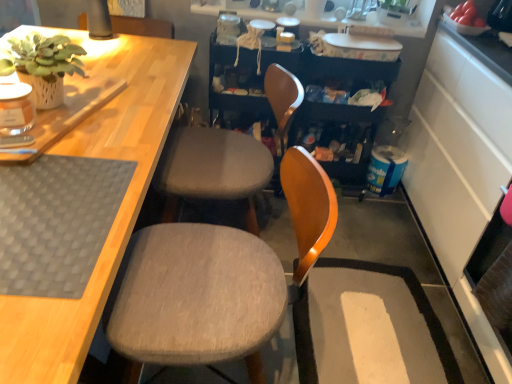
What do you see at coordinates (217, 280) in the screenshot? Image resolution: width=512 pixels, height=384 pixels. I see `gray fabric chair at center, the first chair in the front-to-back sequence` at bounding box center [217, 280].

The image size is (512, 384). What do you see at coordinates (212, 168) in the screenshot?
I see `textured gray cushion at center, the 2th chair positioned from the front` at bounding box center [212, 168].

Describe the element at coordinates (414, 21) in the screenshot. I see `white glossy shelves at upper center` at that location.

In order to face gray woven mat at lower left, should I rotate leftwards or rightwards?

It's best to rotate left around 26.937 degrees.

The width and height of the screenshot is (512, 384). I want to click on green matte plant at upper left, so click(x=42, y=65).

From the picture: From the image's perspective, which one is positioned lower, gray woven mat at lower left or white glossy shelves at upper center?

gray woven mat at lower left is shown below in the image.

Are gray woven mat at lower left and white glossy shelves at upper center beside each other?

gray woven mat at lower left and white glossy shelves at upper center are clearly separated.

Is point (15, 292) positioned in front of point (218, 12)?

Yes, it is in front of point (218, 12).

Consider the image. Between gray fabric chair at center, the first chair in the front-to-back sequence, and white textured rug at lower right, which one has larger size?

gray fabric chair at center, the first chair in the front-to-back sequence.

Between point (266, 322) and point (315, 356), which one is positioned behind?

The point (315, 356) is farther from the camera.

Is gray fabric chair at center, the first chair in the front-to-back sequence, oriented towards white textured rug at lower right?

No, gray fabric chair at center, the first chair in the front-to-back sequence, is not facing towards white textured rug at lower right.

In terms of width, does white glossy shelves at upper center look wider or thinner when compared to white textured rug at lower right?

Clearly, white glossy shelves at upper center has less width compared to white textured rug at lower right.

How much distance is there between white glossy shelves at upper center and white textured rug at lower right?

white glossy shelves at upper center and white textured rug at lower right are 4.51 feet apart from each other.

Does point (243, 13) appear closer or farther from the camera than point (413, 293)?

Point (243, 13) is farther from the camera than point (413, 293).

Are white glossy shelves at upper center and white textured rug at lower right beside each other?

They are not placed beside each other.

From the image's perspective, is gray woven mat at lower left on top of textured gray cushion at center, the first chair when ordered from back to front?

No, from the image's perspective, gray woven mat at lower left is not on top of textured gray cushion at center, the first chair when ordered from back to front.

Is point (4, 180) closer or farther from the camera than point (253, 173)?

Clearly, point (4, 180) is closer to the camera than point (253, 173).

Which of these two, gray woven mat at lower left or textured gray cushion at center, the first chair when ordered from back to front, is bigger?

→ textured gray cushion at center, the first chair when ordered from back to front.

Is gray woven mat at lower left positioned far away from textured gray cushion at center, the 2th chair positioned from the front?

No, gray woven mat at lower left is not far from textured gray cushion at center, the 2th chair positioned from the front.

Can you tell me how much white glossy shelves at upper center and gray fabric chair at center, which ranks as the 2th chair in back-to-front order, differ in facing direction?

The facing directions of white glossy shelves at upper center and gray fabric chair at center, which ranks as the 2th chair in back-to-front order, are 89.1 degrees apart.

From the image's perspective, is white glossy shelves at upper center beneath gray fabric chair at center, the first chair in the front-to-back sequence?

Actually, white glossy shelves at upper center appears above gray fabric chair at center, the first chair in the front-to-back sequence, in the image.

At what (x,y) coordinates should I click in order to perform the action: click on shelf that is behind the gray fabric chair at center, which ranks as the 2th chair in back-to-front order. Please return your answer as a coordinate pair (x, y). The width and height of the screenshot is (512, 384). Looking at the image, I should click on (414, 21).

Consider the image. Is white glossy shelves at upper center to the right of gray fabric chair at center, which ranks as the 2th chair in back-to-front order, from the viewer's perspective?

Correct, you'll find white glossy shelves at upper center to the right of gray fabric chair at center, which ranks as the 2th chair in back-to-front order.

Is white textured rug at lower right facing towards textured gray cushion at center, the 2th chair positioned from the front?

No, white textured rug at lower right is not turned towards textured gray cushion at center, the 2th chair positioned from the front.

Between white textured rug at lower right and textured gray cushion at center, the first chair when ordered from back to front, which one has more height?

Standing taller between the two is textured gray cushion at center, the first chair when ordered from back to front.

Which object is positioned more to the right, white textured rug at lower right or textured gray cushion at center, the first chair when ordered from back to front?

white textured rug at lower right.

Can you confirm if textured gray cushion at center, the first chair when ordered from back to front, is positioned to the right of white textured rug at lower right?

Incorrect, textured gray cushion at center, the first chair when ordered from back to front, is not on the right side of white textured rug at lower right.

In terms of size, does textured gray cushion at center, the 2th chair positioned from the front, appear bigger or smaller than white textured rug at lower right?

Considering their sizes, textured gray cushion at center, the 2th chair positioned from the front, takes up more space than white textured rug at lower right.

Who is taller, textured gray cushion at center, the 2th chair positioned from the front, or white textured rug at lower right?

Standing taller between the two is textured gray cushion at center, the 2th chair positioned from the front.

Is textured gray cushion at center, the first chair when ordered from back to front, touching white textured rug at lower right?

textured gray cushion at center, the first chair when ordered from back to front, and white textured rug at lower right are not in contact.

At what (x,y) coordinates should I click in order to perform the action: click on shelf above the gray woven mat at lower left (from a real-world perspective). Please return your answer as a coordinate pair (x, y). The width and height of the screenshot is (512, 384). Looking at the image, I should click on (414, 21).

Locate an element on the screen. wide below the gray fabric chair at center, the first chair in the front-to-back sequence (from a real-world perspective) is located at coordinates (369, 327).

Considering their positions, is white glossy shelves at upper center positioned closer to gray fabric chair at center, the first chair in the front-to-back sequence, than gray woven mat at lower left?

gray woven mat at lower left.

Looking at this image, when comparing their distances from white glossy shelves at upper center, does textured gray cushion at center, the 2th chair positioned from the front, or green matte plant at upper left seem further?

The object further to white glossy shelves at upper center is green matte plant at upper left.

Which object lies nearer to the anchor point green matte plant at upper left, gray fabric chair at center, which ranks as the 2th chair in back-to-front order, or white textured rug at lower right?

Among the two, gray fabric chair at center, which ranks as the 2th chair in back-to-front order, is located nearer to green matte plant at upper left.

Considering their positions, is green matte plant at upper left positioned closer to gray woven mat at lower left than white glossy shelves at upper center?

green matte plant at upper left lies closer to gray woven mat at lower left than the other object.

In the scene shown: When comparing their distances from white textured rug at lower right, does green matte plant at upper left or gray woven mat at lower left seem closer?

gray woven mat at lower left.

Looking at the image, which one is located closer to gray woven mat at lower left, white glossy shelves at upper center or textured gray cushion at center, the first chair when ordered from back to front?

Based on the image, textured gray cushion at center, the first chair when ordered from back to front, appears to be nearer to gray woven mat at lower left.

Estimate the real-world distances between objects in this image. Which object is further from gray woven mat at lower left, gray fabric chair at center, which ranks as the 2th chair in back-to-front order, or green matte plant at upper left?

green matte plant at upper left is further to gray woven mat at lower left.

Looking at the image, which one is located closer to gray fabric chair at center, which ranks as the 2th chair in back-to-front order, green matte plant at upper left or gray woven mat at lower left?

Among the two, gray woven mat at lower left is located nearer to gray fabric chair at center, which ranks as the 2th chair in back-to-front order.

Where is `chair between green matte plant at upper left and white glossy shelves at upper center along the z-axis`? The width and height of the screenshot is (512, 384). chair between green matte plant at upper left and white glossy shelves at upper center along the z-axis is located at coordinates (212, 168).

I want to click on houseplant located between gray fabric chair at center, the first chair in the front-to-back sequence, and white glossy shelves at upper center in the depth direction, so click(x=42, y=65).

You are a GUI agent. You are given a task and a screenshot of the screen. Output one action in this format:
    pyautogui.click(x=<x>, y=<y>)
    Task: Click on the chair located between gray woven mat at lower left and textured gray cushion at center, the 2th chair positioned from the front, in the depth direction
    
    Given the screenshot: What is the action you would take?
    pyautogui.click(x=217, y=280)

This screenshot has width=512, height=384. What are the coordinates of `chair between gray fabric chair at center, the first chair in the front-to-back sequence, and white glossy shelves at upper center from front to back` in the screenshot? It's located at (212, 168).